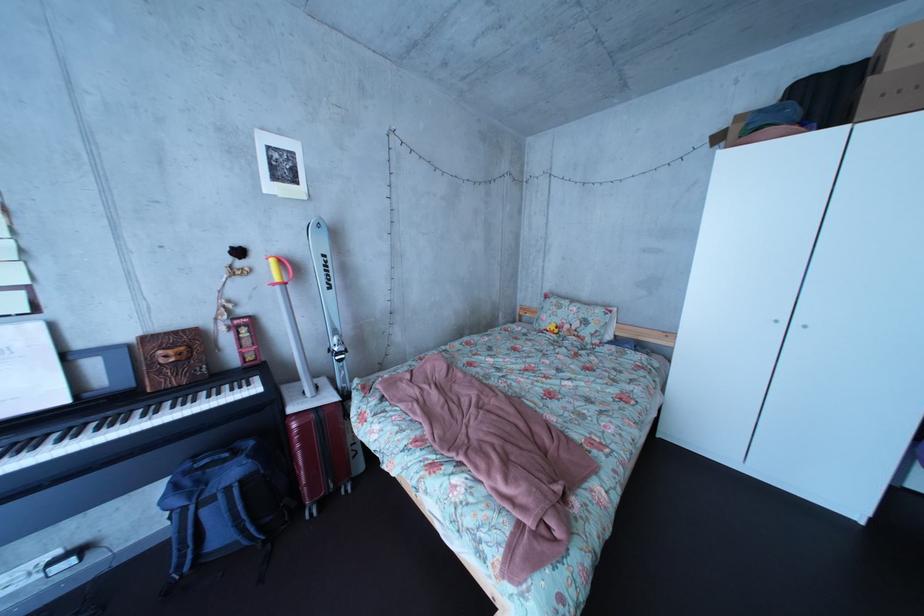
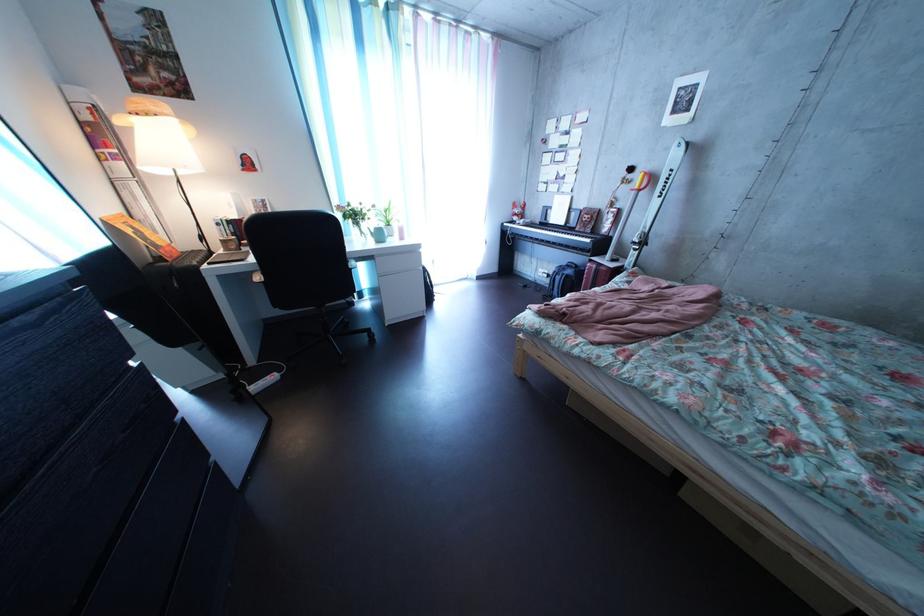
In the second image, find the point that corresponds to the point at 80,408 in the first image.

(577, 232)